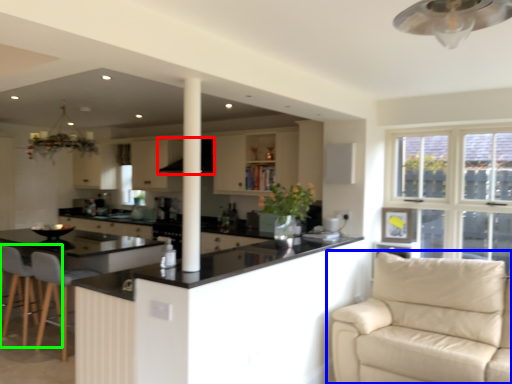
Question: Considering the real-world distances, which object is farthest from exhaust hood (highlighted by a red box)? studio couch (highlighted by a blue box) or swivel chair (highlighted by a green box)?

Choices:
 (A) studio couch
 (B) swivel chair

Answer: (A)